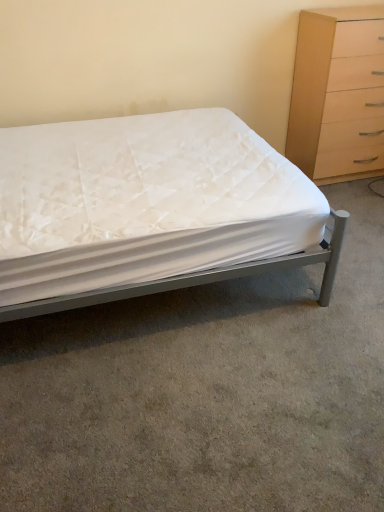
Question: Would you say metallic gray bed at center is to the left or to the right of light wood/texture chest of drawers at upper right in the picture?

Choices:
 (A) left
 (B) right

Answer: (A)

Question: In terms of size, does metallic gray bed at center appear bigger or smaller than light wood/texture chest of drawers at upper right?

Choices:
 (A) small
 (B) big

Answer: (B)

Question: Is metallic gray bed at center in front of or behind light wood/texture chest of drawers at upper right in the image?

Choices:
 (A) front
 (B) behind

Answer: (A)

Question: In the image, is light wood/texture chest of drawers at upper right positioned in front of or behind metallic gray bed at center?

Choices:
 (A) front
 (B) behind

Answer: (B)

Question: Is light wood/texture chest of drawers at upper right taller or shorter than metallic gray bed at center?

Choices:
 (A) tall
 (B) short

Answer: (A)

Question: Visually, is light wood/texture chest of drawers at upper right positioned to the left or to the right of metallic gray bed at center?

Choices:
 (A) left
 (B) right

Answer: (B)

Question: Considering the positions of point (365, 104) and point (18, 274), is point (365, 104) closer or farther from the camera than point (18, 274)?

Choices:
 (A) farther
 (B) closer

Answer: (A)